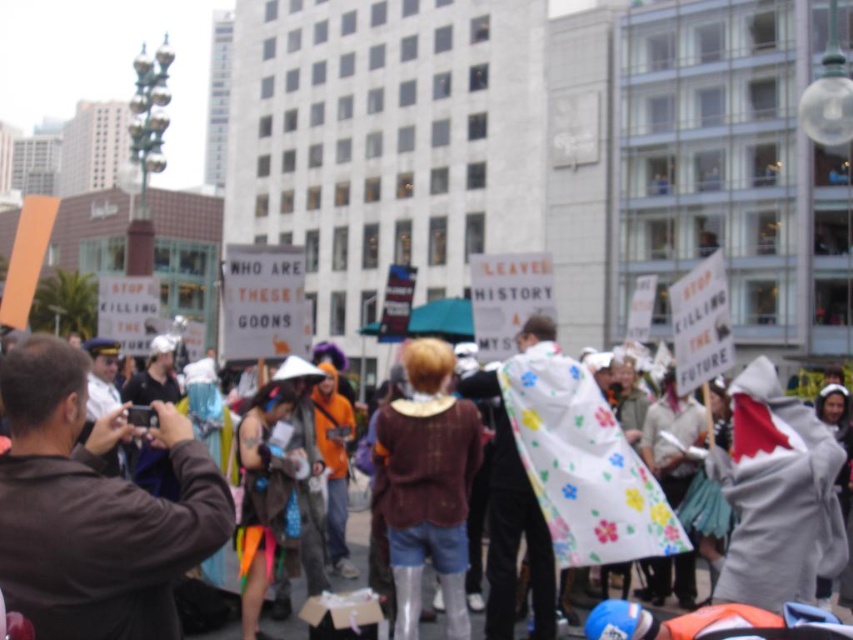
From the picture: Is brown leather jacket at left further to camera compared to brown leather jacket at center?

No, it is in front of brown leather jacket at center.

Looking at this image, who is more forward, (57, 429) or (83, 509)?

Positioned in front is point (83, 509).

Between point (83, 410) and point (38, 570), which one is positioned behind?

Point (83, 410)

Identify the location of brown leather jacket at left. The width and height of the screenshot is (853, 640). (94, 508).